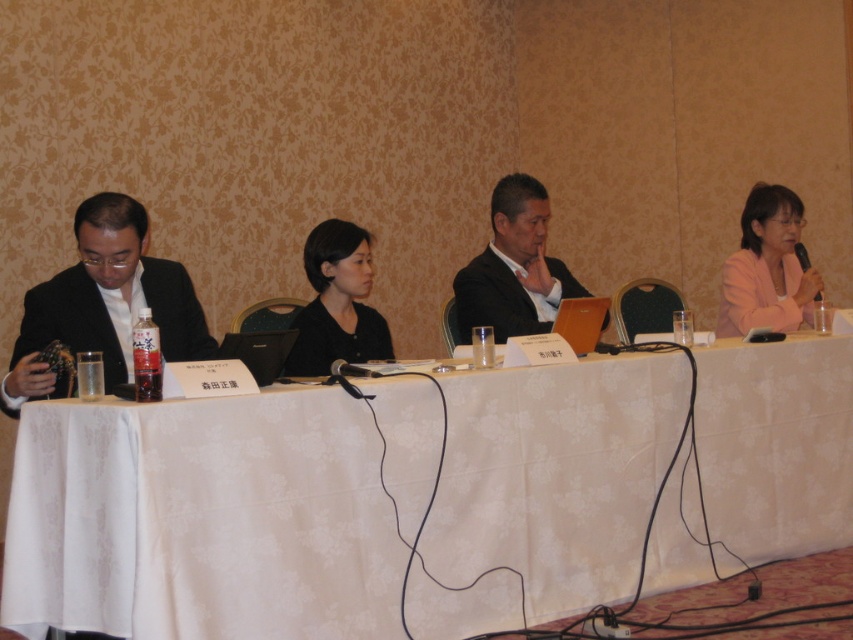
Question: Can you confirm if white fabric table at center is positioned to the right of pink fabric jacket at upper right?

Choices:
 (A) yes
 (B) no

Answer: (B)

Question: Estimate the real-world distances between objects in this image. Which object is closer to the white fabric table at center?

Choices:
 (A) black matte jacket at center
 (B) pink fabric jacket at upper right
 (C) matte black suit at center

Answer: (A)

Question: Which object is farther from the camera taking this photo?

Choices:
 (A) white fabric table at center
 (B) pink fabric jacket at upper right
 (C) matte black suit at left

Answer: (B)

Question: Estimate the real-world distances between objects in this image. Which object is closer to the matte black suit at center?

Choices:
 (A) matte black suit at left
 (B) white fabric table at center
 (C) pink fabric jacket at upper right

Answer: (B)

Question: Is matte black suit at center smaller than pink fabric jacket at upper right?

Choices:
 (A) no
 (B) yes

Answer: (A)

Question: Does white fabric table at center appear on the right side of matte black suit at left?

Choices:
 (A) no
 (B) yes

Answer: (B)